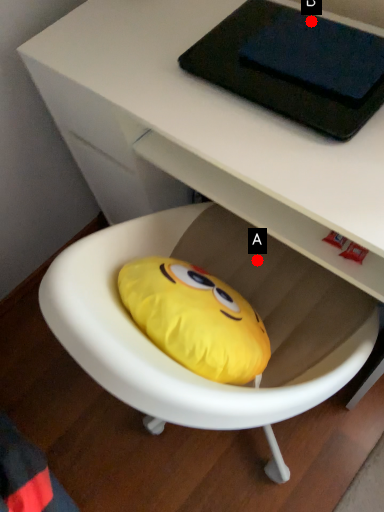
Question: Two points are circled on the image, labeled by A and B beside each circle. Which point is closer to the camera?

Choices:
 (A) A is closer
 (B) B is closer

Answer: (B)